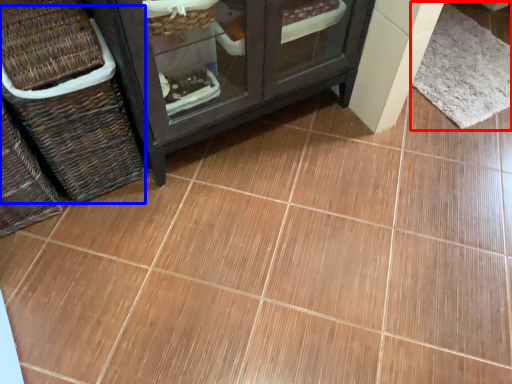
Question: Which object appears closest to the camera in this image, mat (highlighted by a red box) or basket (highlighted by a blue box)?

Choices:
 (A) mat
 (B) basket

Answer: (B)